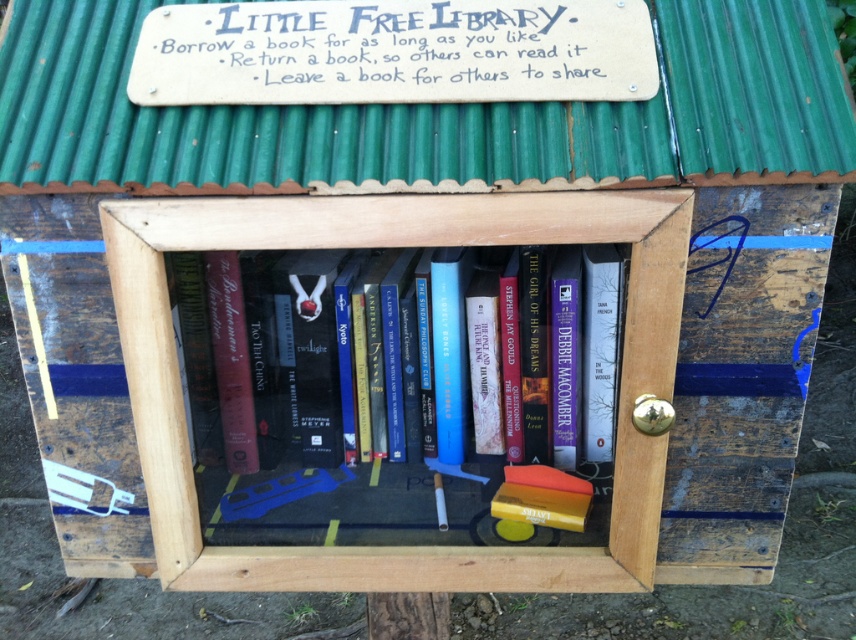
Between wooden bookshelf at center and hardcover book at center, which one appears on the right side from the viewer's perspective?

Positioned to the right is wooden bookshelf at center.

Can you confirm if wooden bookshelf at center is smaller than hardcover book at center?

Incorrect, wooden bookshelf at center is not smaller in size than hardcover book at center.

Who is more forward, (616, 467) or (384, 394)?

Point (616, 467) is in front.

Identify the location of wooden bookshelf at center. (387, 244).